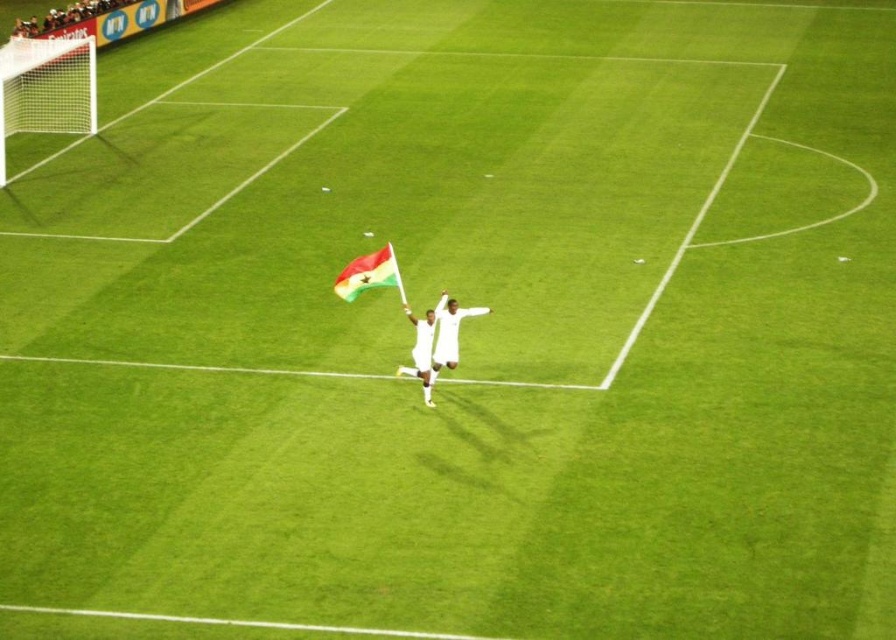
You are a soccer coach observing the field. You notice the white plastic goal at upper left and the white fabric at center. Which object is taller?

The white plastic goal at upper left is much taller than the white fabric at center.

From the picture: You are standing at point (x=14, y=83) on the soccer field. You want to walk to the point that is 23.99 meters away from you. Which direction should you walk to reach that point?

Since the two points are 23.99 meters apart, you should walk in the direction away from the soccer field towards the stadium stands to reach the point that is 23.99 meters away.